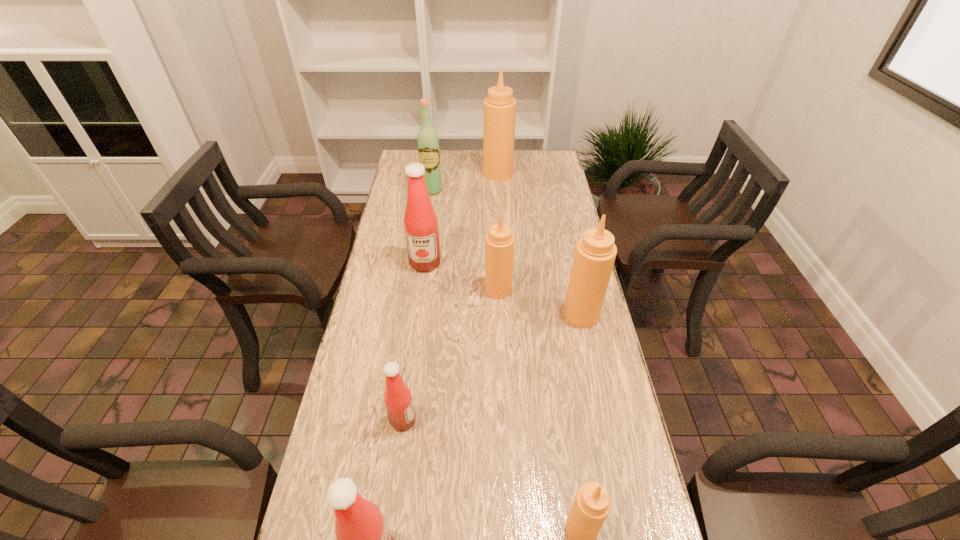
Locate an element on the screen. the tallest condiment is located at coordinates (499, 106).

The image size is (960, 540). What are the coordinates of `the farthest object` in the screenshot? It's located at (499, 106).

What are the coordinates of `white wine bottle` in the screenshot? It's located at (427, 137).

At what (x,y) coordinates should I click in order to perform the action: click on wine bottle. Please return your answer as a coordinate pair (x, y). Looking at the image, I should click on (x=427, y=137).

Where is `the second farthest condiment`? The height and width of the screenshot is (540, 960). the second farthest condiment is located at coordinates [x=420, y=221].

The image size is (960, 540). Find the location of `the farthest red condiment`. the farthest red condiment is located at coordinates (420, 221).

Where is `the rightmost condiment`? the rightmost condiment is located at coordinates (595, 253).

You are a GUI agent. You are given a task and a screenshot of the screen. Output one action in this format:
    pyautogui.click(x=<x>, y=<y>)
    Task: Click on the third farthest tan condiment
    The height and width of the screenshot is (540, 960).
    Given the screenshot: What is the action you would take?
    pyautogui.click(x=595, y=253)

Locate an element on the screen. the third nearest tan condiment is located at coordinates (499, 242).

You are a GUI agent. You are given a task and a screenshot of the screen. Output one action in this format:
    pyautogui.click(x=<x>, y=<y>)
    Task: Click on the fifth nearest object
    
    Given the screenshot: What is the action you would take?
    pyautogui.click(x=499, y=242)